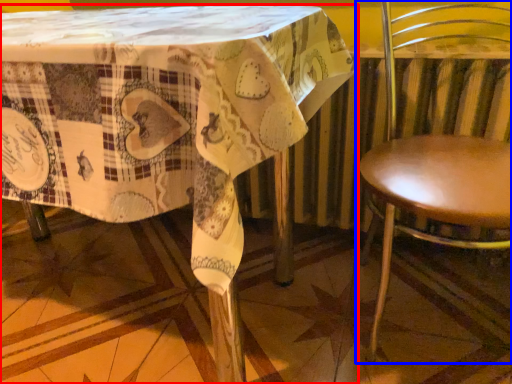
Question: Which object appears closest to the camera in this image, table (highlighted by a red box) or chair (highlighted by a blue box)?

Choices:
 (A) table
 (B) chair

Answer: (A)